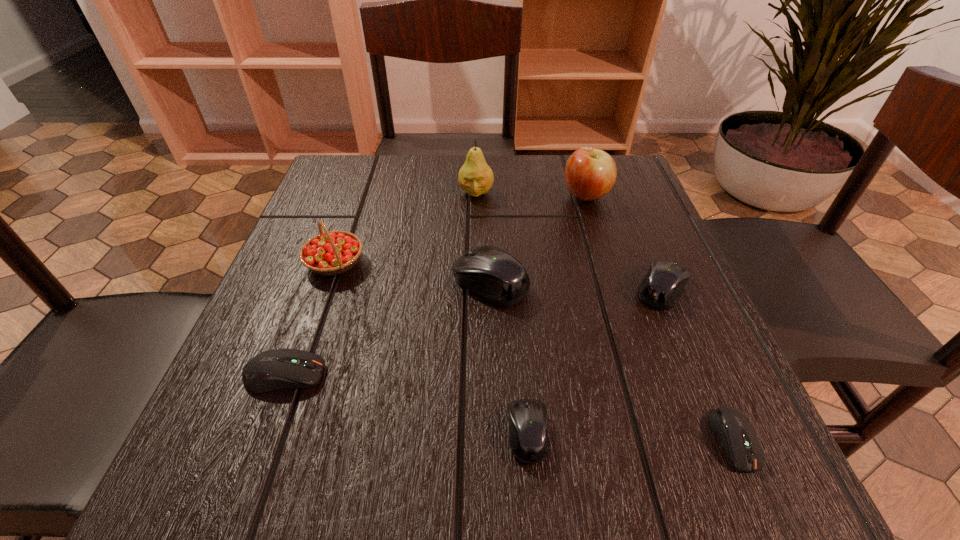
Locate an element on the screen. This screenshot has height=540, width=960. free space that satisfies the following two spatial constraints: 1. on the back side of the smallest black mouse; 2. on the right side of the apple is located at coordinates (509, 197).